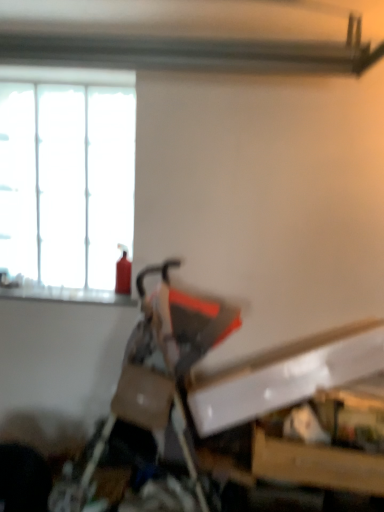
Question: Is smooth glass window sill at upper left located within red matte fire extinguisher at left?

Choices:
 (A) no
 (B) yes

Answer: (A)

Question: Is red matte fire extinguisher at left shorter than smooth glass window sill at upper left?

Choices:
 (A) yes
 (B) no

Answer: (B)

Question: Does red matte fire extinguisher at left come in front of smooth glass window sill at upper left?

Choices:
 (A) yes
 (B) no

Answer: (B)

Question: From the image's perspective, does red matte fire extinguisher at left appear lower than smooth glass window sill at upper left?

Choices:
 (A) yes
 (B) no

Answer: (B)

Question: Is red matte fire extinguisher at left looking in the opposite direction of smooth glass window sill at upper left?

Choices:
 (A) no
 (B) yes

Answer: (A)

Question: From a real-world perspective, is red matte fire extinguisher at left located higher than smooth glass window sill at upper left?

Choices:
 (A) no
 (B) yes

Answer: (B)

Question: Does white frosted glass window at upper left have a smaller size compared to matte black swivel chair at center?

Choices:
 (A) yes
 (B) no

Answer: (A)

Question: Can you confirm if white frosted glass window at upper left is thinner than matte black swivel chair at center?

Choices:
 (A) no
 (B) yes

Answer: (B)

Question: Could you tell me if white frosted glass window at upper left is facing matte black swivel chair at center?

Choices:
 (A) no
 (B) yes

Answer: (A)

Question: Can you confirm if white frosted glass window at upper left is bigger than matte black swivel chair at center?

Choices:
 (A) yes
 (B) no

Answer: (B)

Question: Is white frosted glass window at upper left oriented away from matte black swivel chair at center?

Choices:
 (A) yes
 (B) no

Answer: (B)

Question: Can you confirm if white frosted glass window at upper left is positioned to the left of matte black swivel chair at center?

Choices:
 (A) no
 (B) yes

Answer: (B)

Question: From a real-world perspective, is matte black swivel chair at center physically below white frosted glass window at upper left?

Choices:
 (A) no
 (B) yes

Answer: (B)